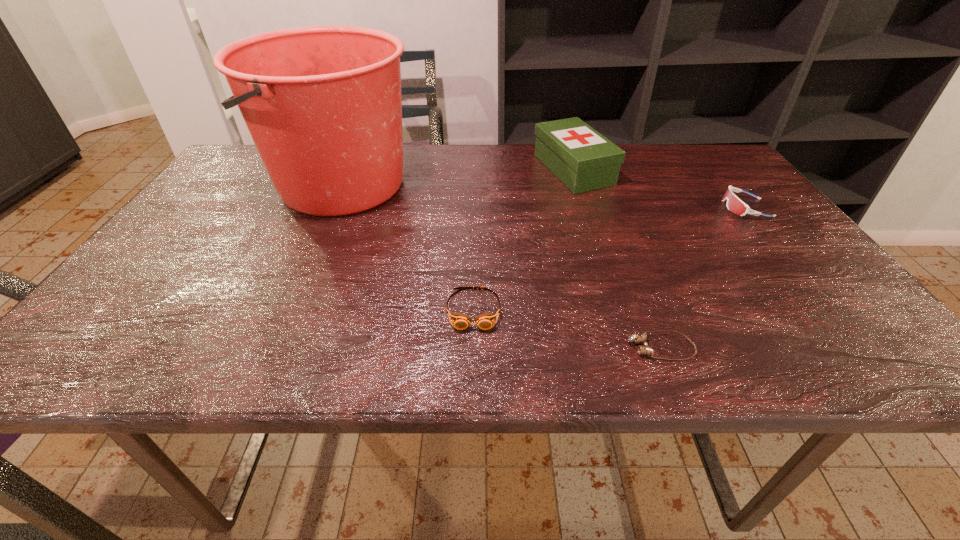
What are the coordinates of `free space between the fourth shortest object and the tallest object` in the screenshot? It's located at (458, 177).

What are the coordinates of `free spot between the first-aid kit and the fourth object from right to left` in the screenshot? It's located at (523, 240).

You are a GUI agent. You are given a task and a screenshot of the screen. Output one action in this format:
    pyautogui.click(x=<x>, y=<y>)
    Task: Click on the free space between the tallest object and the second farthest goggles
    The height and width of the screenshot is (540, 960).
    Given the screenshot: What is the action you would take?
    [408, 246]

Where is `free space between the third tallest object and the nearest goggles`? The height and width of the screenshot is (540, 960). free space between the third tallest object and the nearest goggles is located at coordinates (703, 278).

This screenshot has height=540, width=960. In order to click on free space between the second tallest goggles and the nearest goggles in this screenshot , I will do 567,329.

Identify the location of free point between the nearest goggles and the leftmost object. (501, 266).

Locate an element on the screen. Image resolution: width=960 pixels, height=540 pixels. vacant area that lies between the first-aid kit and the leftmost goggles is located at coordinates (523, 240).

Locate an element on the screen. The image size is (960, 540). vacant space that's between the tallest object and the shortest object is located at coordinates (501, 266).

The height and width of the screenshot is (540, 960). I want to click on vacant space in between the third tallest object and the shortest goggles, so click(703, 278).

Locate an element on the screen. The image size is (960, 540). object that is the fourth closest to the leftmost object is located at coordinates (734, 204).